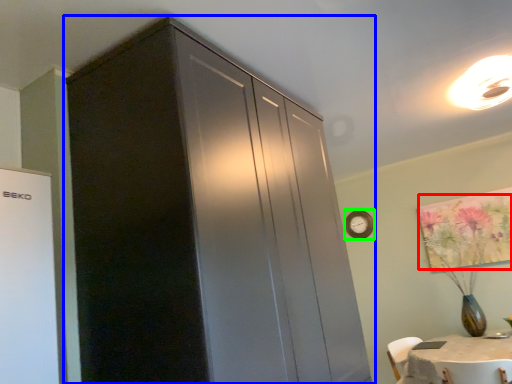
Question: Which is farther away from flower (highlighted by a red box)? cupboard (highlighted by a blue box) or clock (highlighted by a green box)?

Choices:
 (A) cupboard
 (B) clock

Answer: (A)